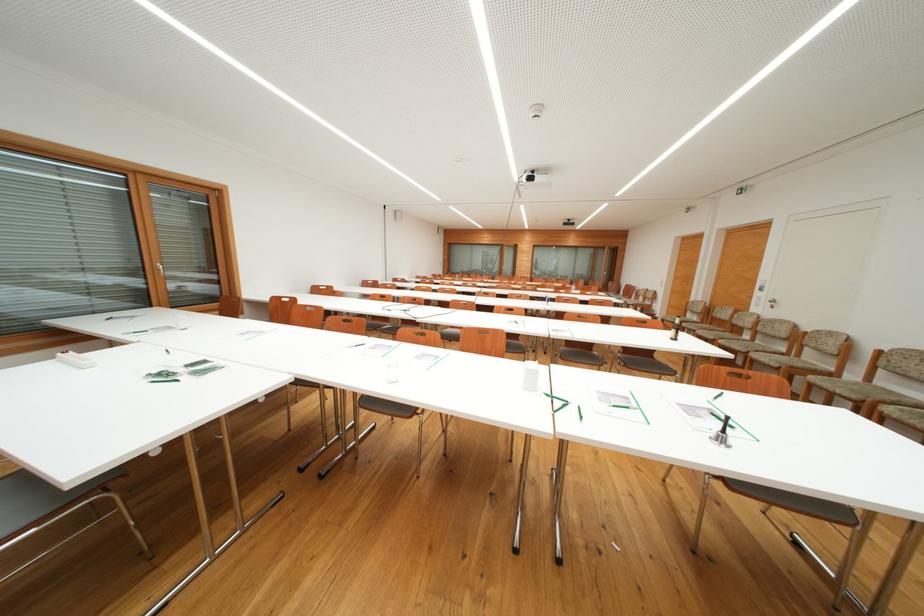
The height and width of the screenshot is (616, 924). In order to click on dark glass bottle in this screenshot , I will do `click(722, 432)`.